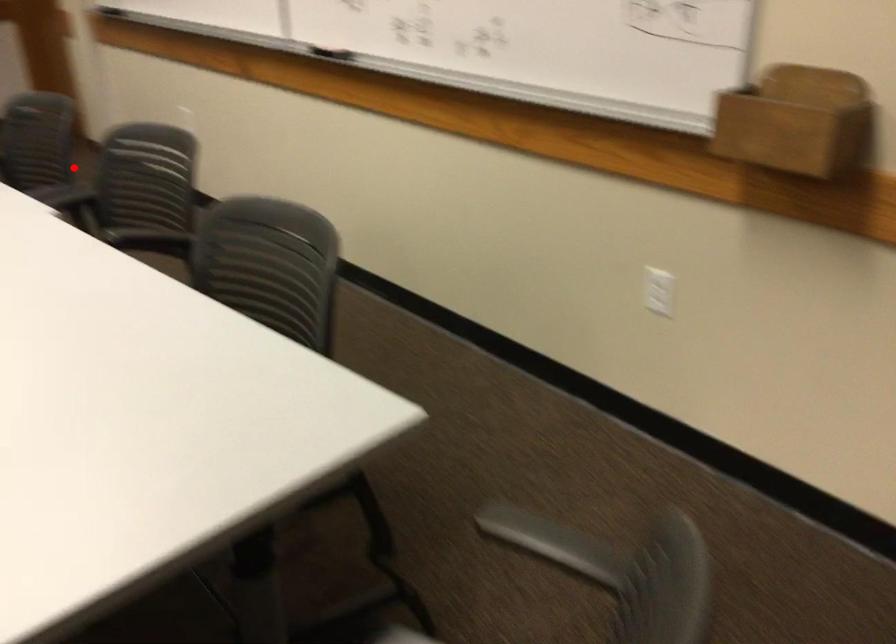
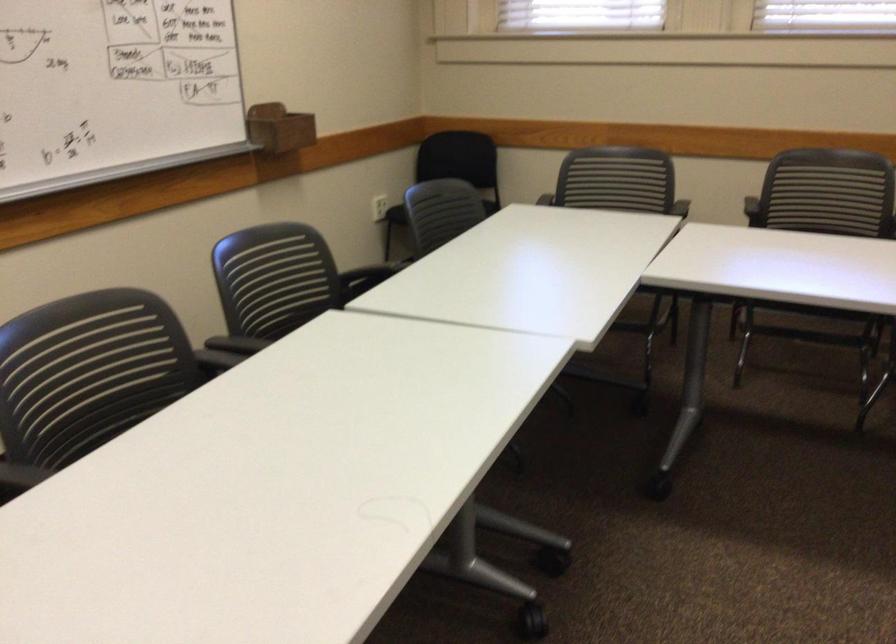
In the second image, find the point that corresponds to the highlighted location in the first image.

(125, 375)